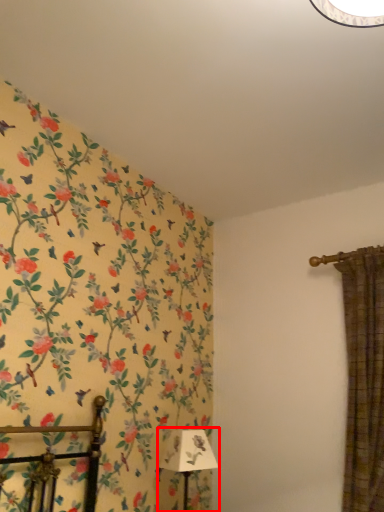
Question: From the image's perspective, where is table lamp (annotated by the red box) located relative to curtain?

Choices:
 (A) below
 (B) above

Answer: (A)